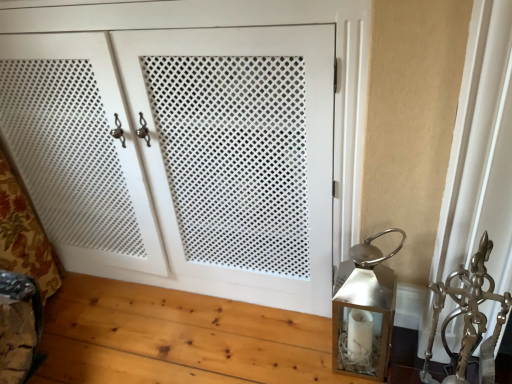
Question: Is white matte cabinet doors at center positioned in front of metallic silver sculpture at right?

Choices:
 (A) no
 (B) yes

Answer: (A)

Question: From the image's perspective, is white matte cabinet doors at center on top of metallic silver sculpture at right?

Choices:
 (A) no
 (B) yes

Answer: (B)

Question: Is white matte cabinet doors at center wider than metallic silver sculpture at right?

Choices:
 (A) no
 (B) yes

Answer: (B)

Question: Is metallic silver sculpture at right at the back of white matte cabinet doors at center?

Choices:
 (A) no
 (B) yes

Answer: (A)

Question: Does white matte cabinet doors at center appear on the right side of metallic silver sculpture at right?

Choices:
 (A) no
 (B) yes

Answer: (A)

Question: In terms of width, does metallic silver sculpture at right look wider or thinner when compared to white matte cabinet doors at center?

Choices:
 (A) wide
 (B) thin

Answer: (B)

Question: Would you say metallic silver sculpture at right is to the left or to the right of white matte cabinet doors at center in the picture?

Choices:
 (A) right
 (B) left

Answer: (A)

Question: Considering their positions, is metallic silver sculpture at right located in front of or behind white matte cabinet doors at center?

Choices:
 (A) behind
 (B) front

Answer: (B)

Question: Looking at the image, does metallic silver sculpture at right seem bigger or smaller compared to white matte cabinet doors at center?

Choices:
 (A) small
 (B) big

Answer: (A)

Question: Choose the correct answer: Is metallic silver sculpture at right inside silver metallic lantern at right or outside it?

Choices:
 (A) inside
 (B) outside

Answer: (B)

Question: From a real-world perspective, is metallic silver sculpture at right positioned above or below silver metallic lantern at right?

Choices:
 (A) above
 (B) below

Answer: (A)

Question: Considering the positions of metallic silver sculpture at right and silver metallic lantern at right in the image, is metallic silver sculpture at right bigger or smaller than silver metallic lantern at right?

Choices:
 (A) small
 (B) big

Answer: (B)

Question: Does point (492, 339) appear closer or farther from the camera than point (371, 266)?

Choices:
 (A) farther
 (B) closer

Answer: (B)

Question: Is white matte cabinet doors at center in front of or behind metallic silver sculpture at right in the image?

Choices:
 (A) behind
 (B) front

Answer: (A)

Question: Considering the positions of point (156, 49) and point (479, 322), is point (156, 49) closer or farther from the camera than point (479, 322)?

Choices:
 (A) farther
 (B) closer

Answer: (A)